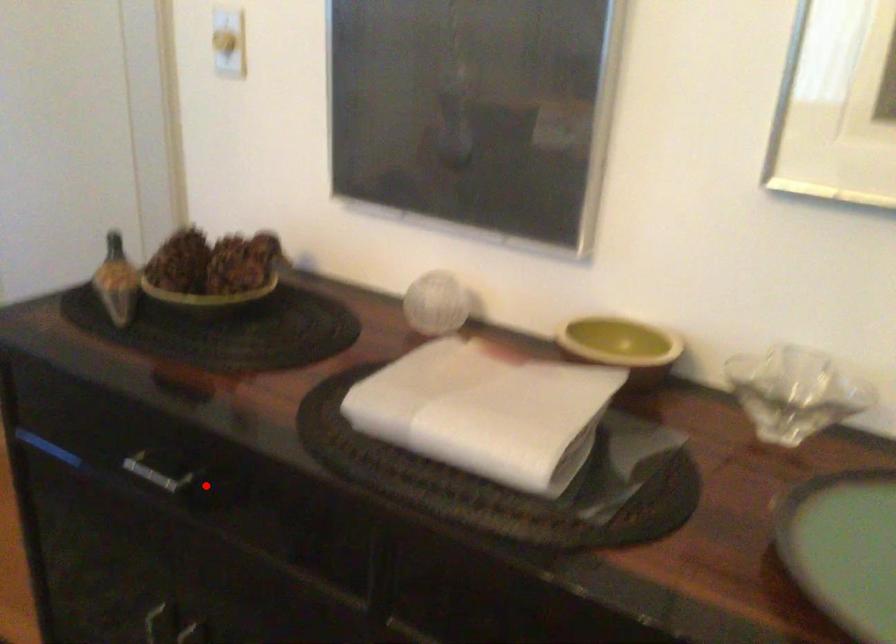
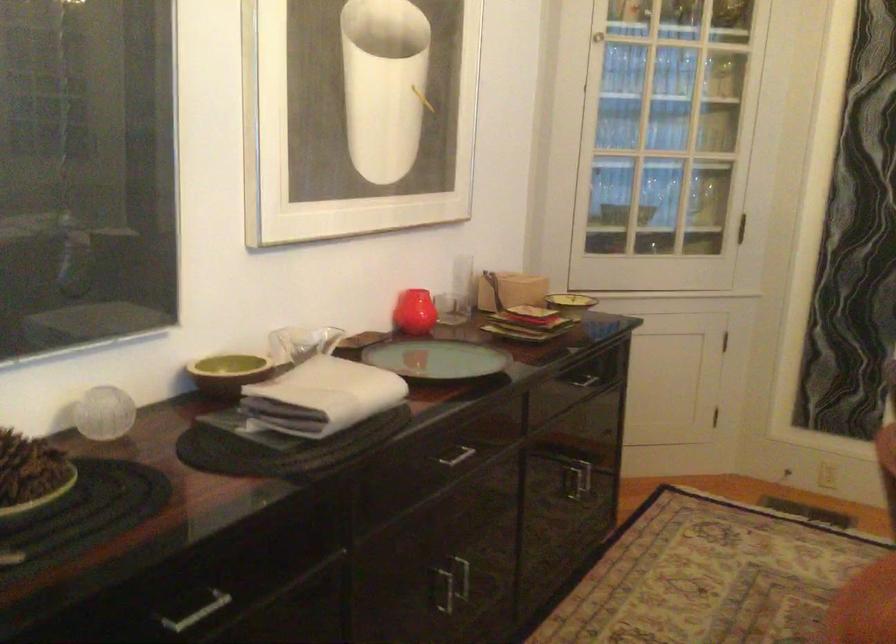
Question: I am providing you with two images of the same scene from different viewpoints. In image1, a red point is highlighted. Considering the same 3D point in image2, which of the following is correct?

Choices:
 (A) It is closer
 (B) It is farther

Answer: (B)